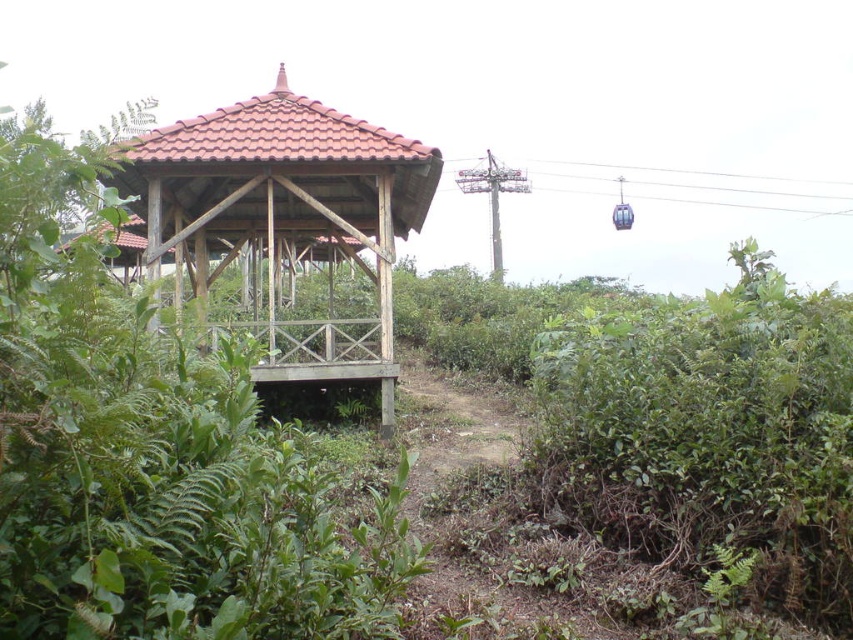
Consider the image. You are planning to place a small garden statue that requires 2 square meters of space. You have two options near the gazebo area. The first option is next to the green leafy bush at lower right, and the second option is near the wooden gazebo at center. Which location has enough space for the statue?

The wooden gazebo at center occupies more space than the green leafy bush at lower right, so the area near the wooden gazebo at center likely has enough space for the statue since it requires 2 square meters.

You are standing at the point marked as point (537, 442) and want to walk to the gazebo. The gazebo is elevated 1.5 feet above the ground. If you have a ladder that is 2 feet tall, can you reach the gazebo platform?

The gazebo platform is elevated 1.5 feet above the ground, and your ladder is 2 feet tall, so yes, you can reach the gazebo platform with the ladder since it is taller than the elevation difference.

You are a gardener standing at the entrance of the wooden gazebo at center. You want to trim the green leafy bush at lower right to make sure it doesn not block the view of the gazebo. Based on their heights, is this adjustment necessary?

The green leafy bush at lower right is not as tall as the wooden gazebo at center, so it won not block the view of the gazebo. Therefore, trimming it for that purpose is unnecessary.